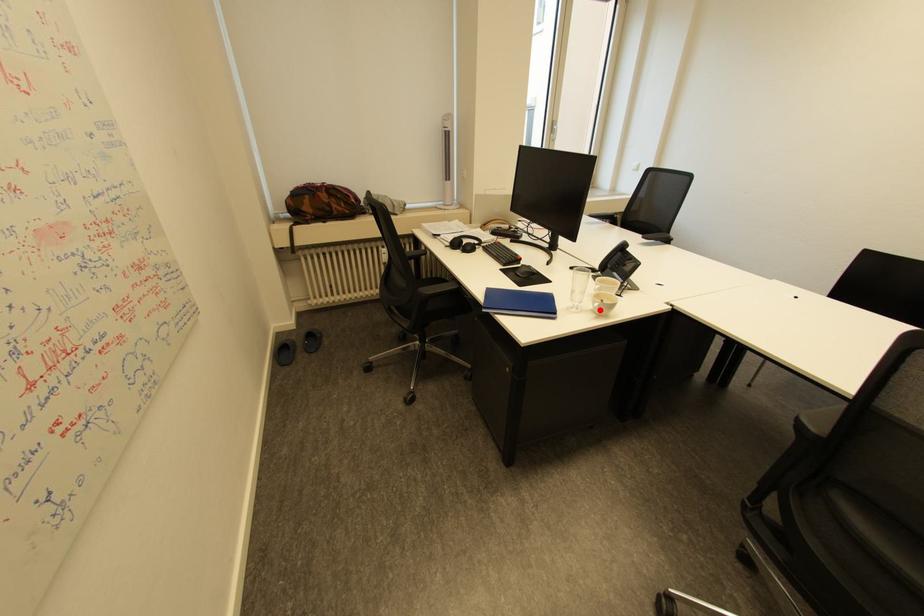
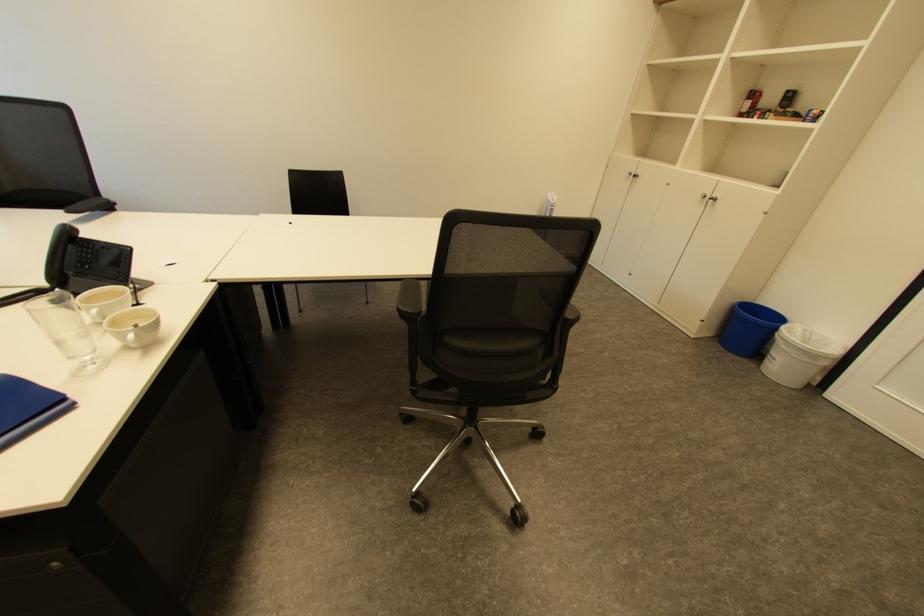
The point at the highlighted location is marked in the first image. Where is the corresponding point in the second image?

(131, 347)